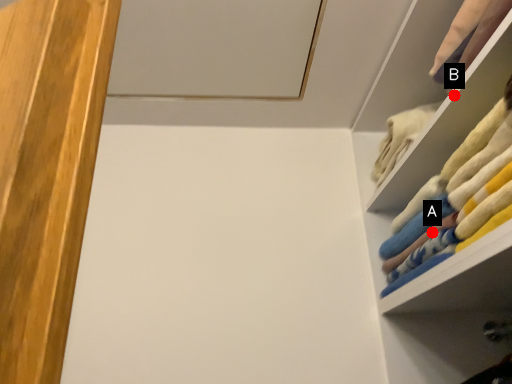
Question: Two points are circled on the image, labeled by A and B beside each circle. Which of the following is the closest to the observer?

Choices:
 (A) A is closer
 (B) B is closer

Answer: (B)